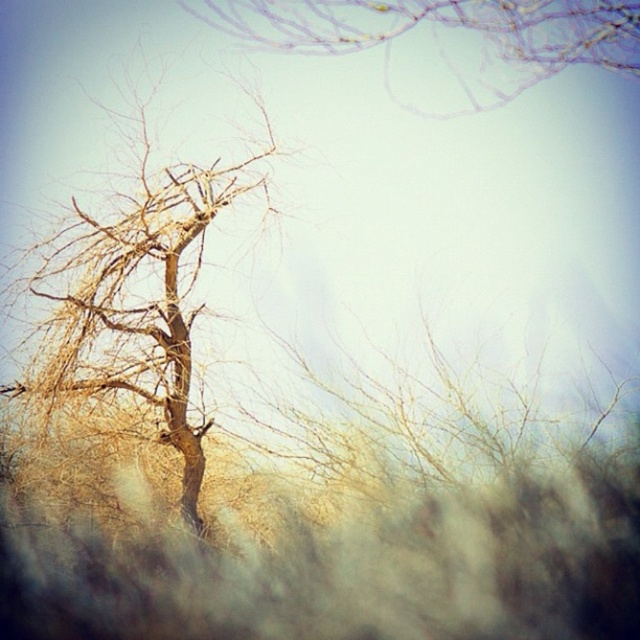
Does point (49, 368) come behind point (504, 45)?

No, it is in front of (504, 45).

Which is more to the right, bare wood tree at left or bare branches at upper center?

bare branches at upper center

Is point (156, 369) farther from viewer compared to point (518, 81)?

No, (156, 369) is in front of (518, 81).

Find the location of a particular element. The height and width of the screenshot is (640, 640). bare wood tree at left is located at coordinates (136, 301).